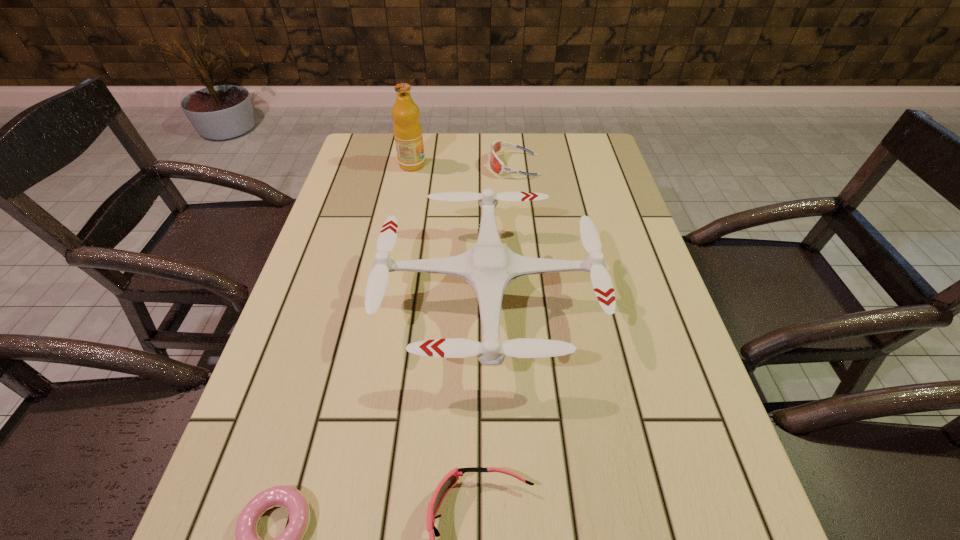
At what (x,y) coordinates should I click in order to perform the action: click on vacant space located 0.290m on the front-facing side of the third shortest object. Please return your answer as a coordinate pair (x, y). Looking at the image, I should click on (396, 165).

Where is `vacant space located 0.220m on the front-facing side of the third shortest object`? This screenshot has width=960, height=540. vacant space located 0.220m on the front-facing side of the third shortest object is located at coordinates (419, 165).

The image size is (960, 540). Identify the location of fruit juice that is positioned at the far edge. (407, 128).

Locate an element on the screen. The image size is (960, 540). goggles present at the far edge is located at coordinates (495, 163).

Identify the location of object at the left edge. The image size is (960, 540). (407, 128).

Identify the location of object that is at the right edge. (489, 267).

Locate an element on the screen. Image resolution: width=960 pixels, height=540 pixels. object at the far left corner is located at coordinates (407, 128).

The image size is (960, 540). I want to click on vacant position at the far edge of the desktop, so click(453, 146).

Locate an element on the screen. vacant space at the left edge of the desktop is located at coordinates (363, 177).

You are a GUI agent. You are given a task and a screenshot of the screen. Output one action in this format:
    pyautogui.click(x=<x>, y=<y>)
    Task: Click on the free space at the right edge
    
    Given the screenshot: What is the action you would take?
    pyautogui.click(x=636, y=232)